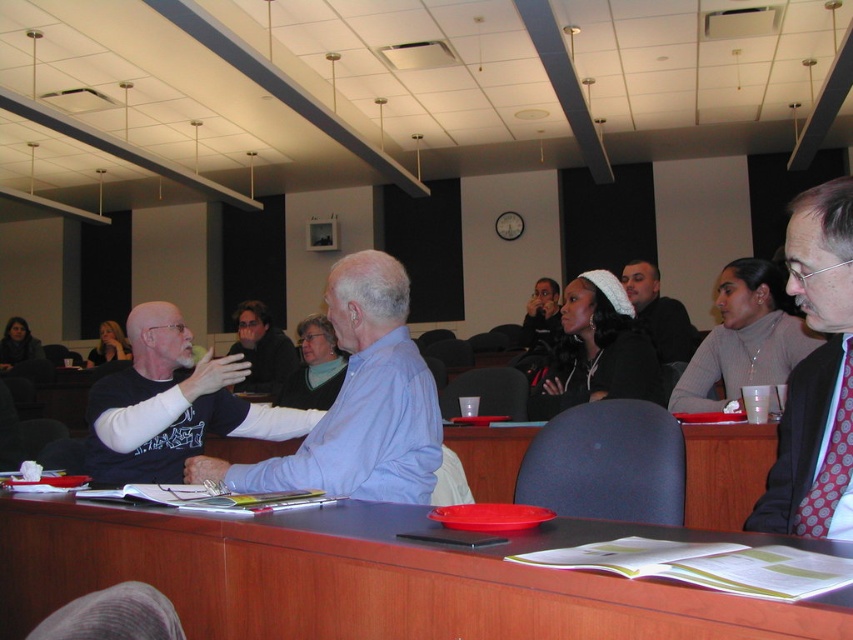
Which is more to the right, brown wood table at center or polka dot tie at right?

From the viewer's perspective, polka dot tie at right appears more on the right side.

Is brown wood table at center shorter than polka dot tie at right?

Yes, brown wood table at center is shorter than polka dot tie at right.

The image size is (853, 640). What do you see at coordinates (372, 577) in the screenshot?
I see `brown wood table at center` at bounding box center [372, 577].

Image resolution: width=853 pixels, height=640 pixels. I want to click on brown wood table at center, so click(x=372, y=577).

Is white knit hat at center thinner than red dotted tie at right?

No.

Is white knit hat at center above red dotted tie at right?

Correct, white knit hat at center is located above red dotted tie at right.

Is point (622, 333) farther from camera compared to point (830, 497)?

Yes, point (622, 333) is behind point (830, 497).

Find the location of a particular element. white knit hat at center is located at coordinates (596, 349).

Looking at this image, between white knit hat at center and dark brown hair at center, which one has more height?

Standing taller between the two is dark brown hair at center.

Does point (607, 323) lie behind point (662, 314)?

No, (607, 323) is closer to viewer.

Identify the location of white knit hat at center. Image resolution: width=853 pixels, height=640 pixels. (596, 349).